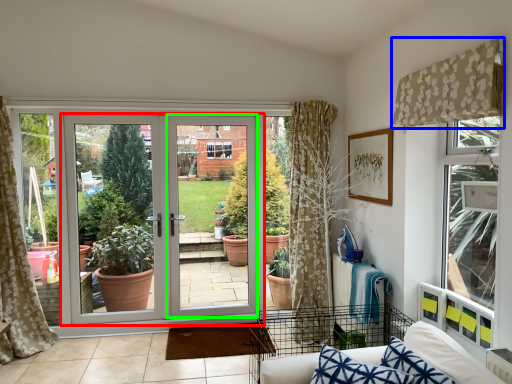
Question: Considering the real-world distances, which object is closest to door (highlighted by a red box)? curtain (highlighted by a blue box) or screen door (highlighted by a green box).

Choices:
 (A) curtain
 (B) screen door

Answer: (B)